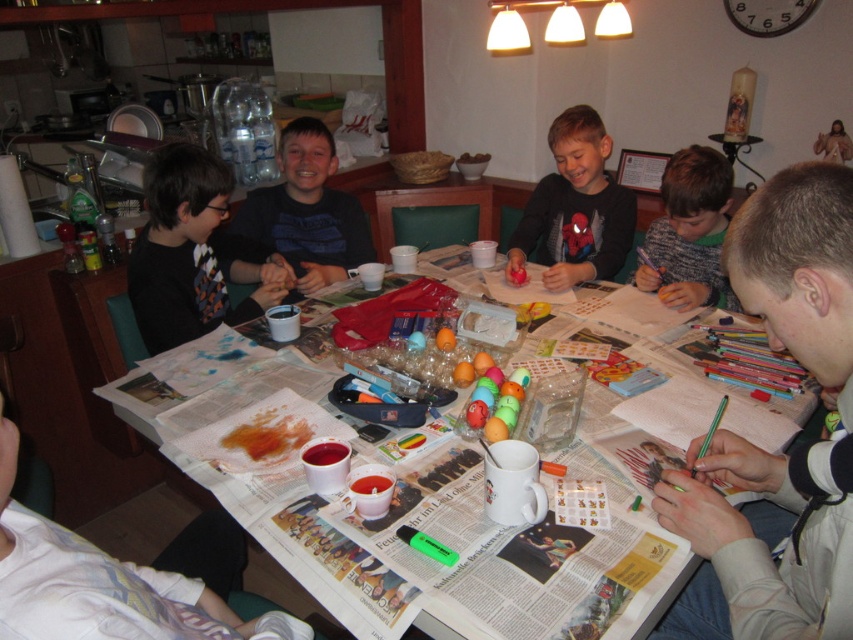
Question: Which of these objects is positioned farthest from the white cotton shirt at lower left?

Choices:
 (A) striped sweater at center
 (B) matte black shirt at left
 (C) matte black shirt at center

Answer: (C)

Question: Which object is the farthest from the striped sweater at center?

Choices:
 (A) matte black shirt at center
 (B) matte black shirt at left

Answer: (A)

Question: Estimate the real-world distances between objects in this image. Which object is closer to the smooth gray shirt at lower right?

Choices:
 (A) matte black shirt at center
 (B) white cotton shirt at lower left

Answer: (B)

Question: Does smooth gray shirt at lower right appear on the left side of white cotton shirt at lower left?

Choices:
 (A) yes
 (B) no

Answer: (B)

Question: Can you confirm if matte black shirt at left is positioned to the right of striped sweater at center?

Choices:
 (A) yes
 (B) no

Answer: (B)

Question: Where is striped sweater at center located in relation to newspaper-covered table at center in the image?

Choices:
 (A) right
 (B) left

Answer: (B)